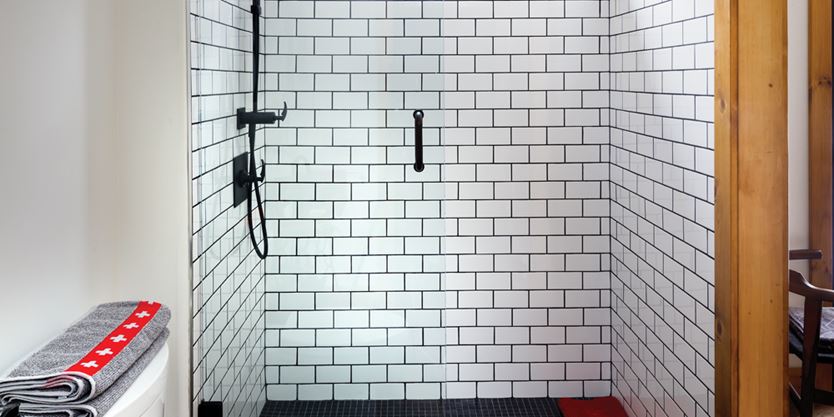
The height and width of the screenshot is (417, 834). I want to click on right wall of shower, so click(x=681, y=209).